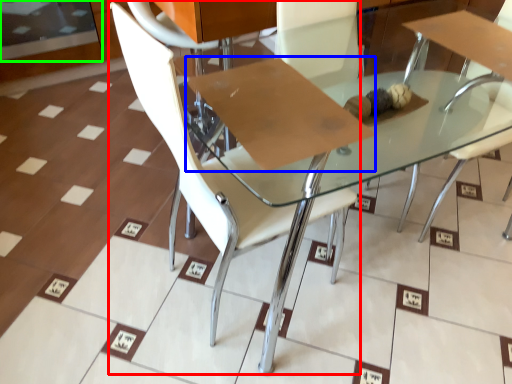
Question: Which object is the closest to the chair (highlighted by a red box)? Choose among these: cardboard (highlighted by a blue box) or glass door (highlighted by a green box).

Choices:
 (A) cardboard
 (B) glass door

Answer: (A)